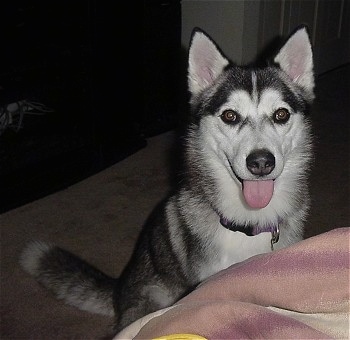
You are a GUI agent. You are given a task and a screenshot of the screen. Output one action in this format:
    pyautogui.click(x=<x>, y=<y>)
    Task: Click on the wall
    This screenshot has height=340, width=350.
    Given the screenshot: What is the action you would take?
    pyautogui.click(x=228, y=16)